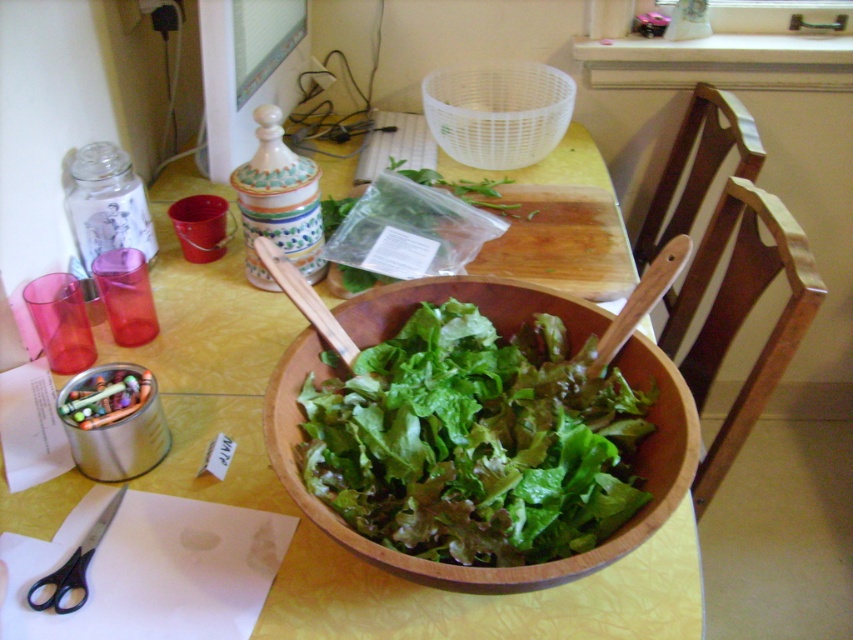
You are a chef preparing a salad and need to reach for the wooden salad bowl at center and the black plastic scissors at lower left. Which object is closer to your left side?

The black plastic scissors at lower left are closer to your left side since they are positioned to the left of the wooden salad bowl at center.

You are setting up a kitchen display for a cooking class. You have a wooden bowl at center and a transparent plastic basket at upper center. Which object should you place on a shelf that requires items to be at least 15 cm in height?

The wooden bowl at center should be placed on the shelf requiring items to be at least 15 cm in height because it is much taller than the transparent plastic basket at upper center.

You are preparing a salad and need to decide which item to move first. Since the wooden salad bowl at center is wider than the black plastic scissors at lower left, which item should you move first to make space?

The wooden salad bowl at center is wider than the black plastic scissors at lower left, so you should move the black plastic scissors at lower left first to free up more space quickly.